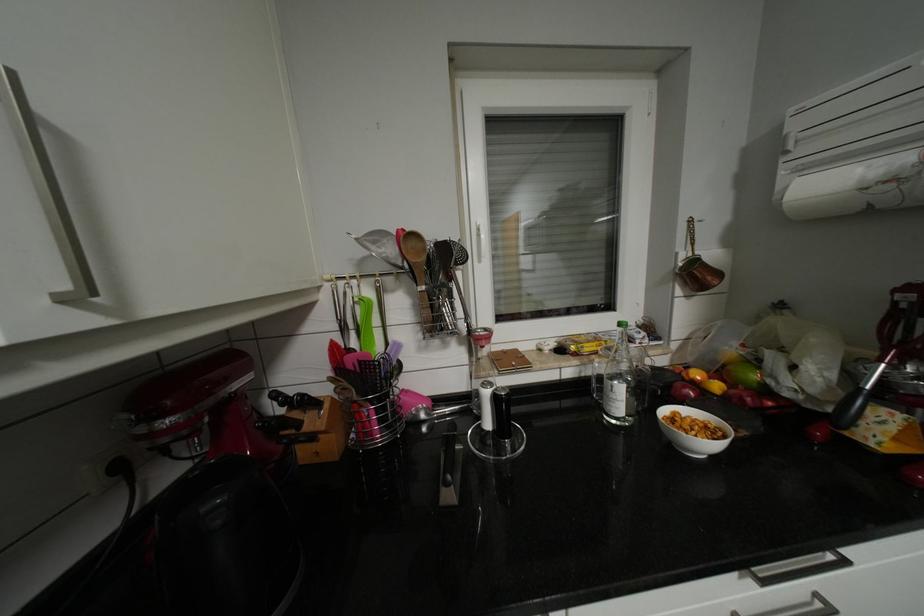
Locate an element on the screen. faucet handle is located at coordinates (691, 378).